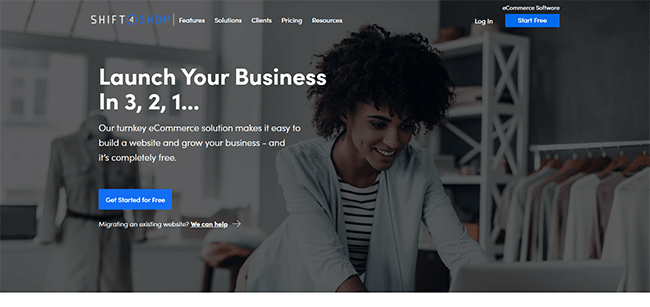
Where is `stool with clothing items draped over it`? stool with clothing items draped over it is located at coordinates (233, 252).